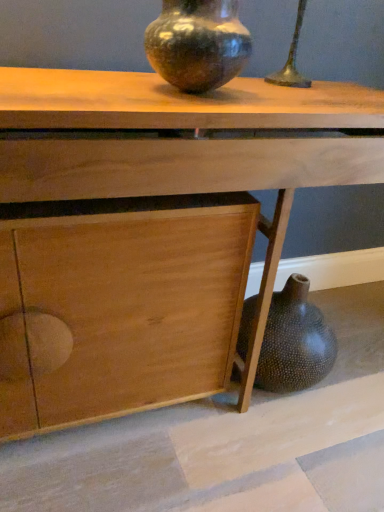
Question: From the image's perspective, is speckled dark brown vase at upper center above or below wooden table at center?

Choices:
 (A) below
 (B) above

Answer: (B)

Question: From a real-world perspective, is speckled dark brown vase at upper center positioned above or below wooden table at center?

Choices:
 (A) below
 (B) above

Answer: (B)

Question: Is speckled dark brown vase at upper center situated inside wooden table at center or outside?

Choices:
 (A) outside
 (B) inside

Answer: (A)

Question: Visually, is wooden table at center positioned to the left or to the right of speckled dark brown vase at upper center?

Choices:
 (A) right
 (B) left

Answer: (A)

Question: Considering the positions of wooden table at center and speckled dark brown vase at upper center in the image, is wooden table at center bigger or smaller than speckled dark brown vase at upper center?

Choices:
 (A) big
 (B) small

Answer: (A)

Question: Is wooden table at center in front of or behind speckled dark brown vase at upper center in the image?

Choices:
 (A) behind
 (B) front

Answer: (B)

Question: Considering the positions of point (231, 280) and point (211, 59), is point (231, 280) closer or farther from the camera than point (211, 59)?

Choices:
 (A) closer
 (B) farther

Answer: (B)